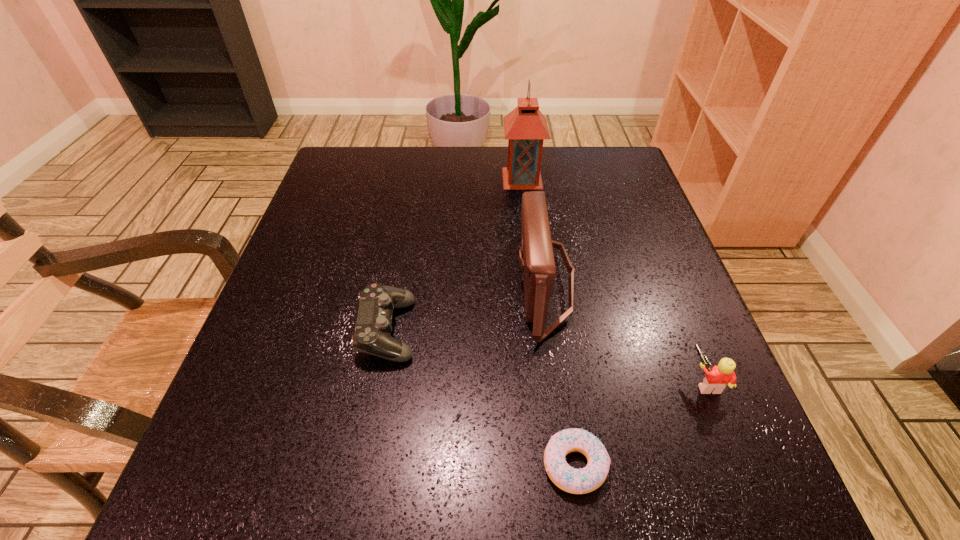
Identify the location of free space between the fourth shortest object and the rightmost object. This screenshot has height=540, width=960. (625, 333).

I want to click on vacant space in between the third shortest object and the leftmost object, so click(x=546, y=356).

Locate an element on the screen. Image resolution: width=960 pixels, height=540 pixels. unoccupied area between the shortest object and the Lego is located at coordinates (640, 423).

You are a GUI agent. You are given a task and a screenshot of the screen. Output one action in this format:
    pyautogui.click(x=<x>, y=<y>)
    Task: Click on the vacant point located between the control and the fourth shortest object
    The width and height of the screenshot is (960, 540).
    Given the screenshot: What is the action you would take?
    pyautogui.click(x=466, y=307)

You are a GUI agent. You are given a task and a screenshot of the screen. Output one action in this format:
    pyautogui.click(x=<x>, y=<y>)
    Task: Click on the vacant area that lies between the doughnut and the rightmost object
    
    Given the screenshot: What is the action you would take?
    pyautogui.click(x=640, y=423)

This screenshot has height=540, width=960. In order to click on vacant area between the farthest object and the Lego in this screenshot , I will do `click(613, 280)`.

Identify the location of object that is the second closest to the rightmost object. The image size is (960, 540). (576, 481).

Identify which object is located as the second nearest to the rightmost object. Please provide its 2D coordinates. Your answer should be formatted as a tuple, i.e. [(x, y)], where the tuple contains the x and y coordinates of a point satisfying the conditions above.

[(576, 481)]

Find the location of a particular element. free spot that satisfies the following two spatial constraints: 1. on the front flap of the second tallest object; 2. on the front side of the control is located at coordinates (551, 330).

This screenshot has height=540, width=960. What are the coordinates of `vacant region that satisfies the following two spatial constraints: 1. on the back side of the doughnut; 2. on the front flap of the fourth shortest object` in the screenshot? It's located at point(548,284).